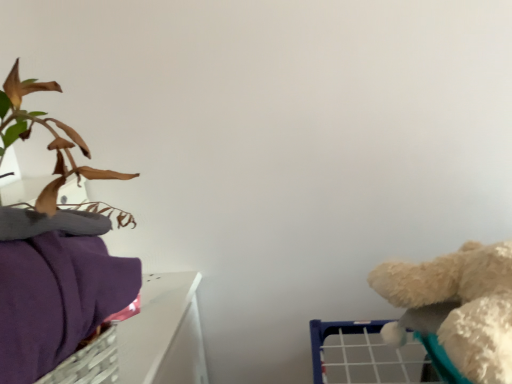
The image size is (512, 384). What do you see at coordinates (456, 306) in the screenshot?
I see `fluffy white teddy bear at right` at bounding box center [456, 306].

Measure the distance between fluffy white teddy bear at right and camera.

A distance of 47.57 centimeters exists between fluffy white teddy bear at right and camera.

The width and height of the screenshot is (512, 384). I want to click on fluffy white teddy bear at right, so click(456, 306).

Locate an element on the screen. Image resolution: width=512 pixels, height=384 pixels. fluffy white teddy bear at right is located at coordinates (456, 306).